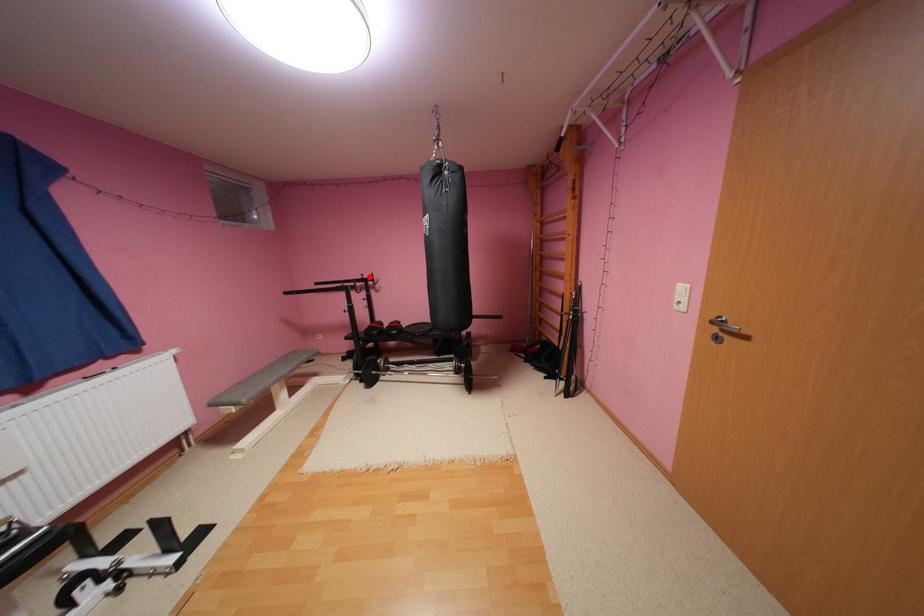
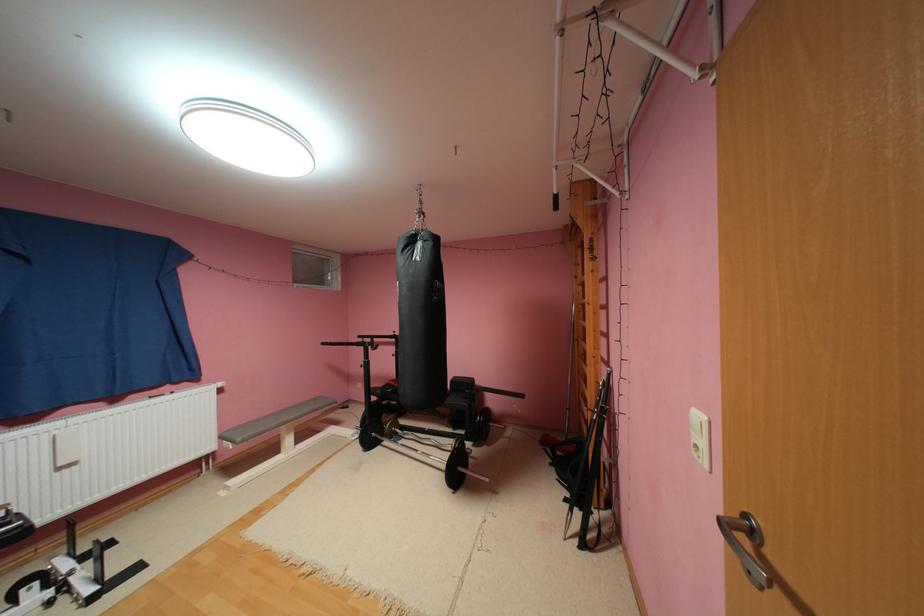
Question: A red point is marked in image1. In image2, is the corresponding 3D point closer to the camera or farther? Reply with the corresponding letter.

Choices:
 (A) The corresponding 3D point is closer.
 (B) The corresponding 3D point is farther.

Answer: (B)